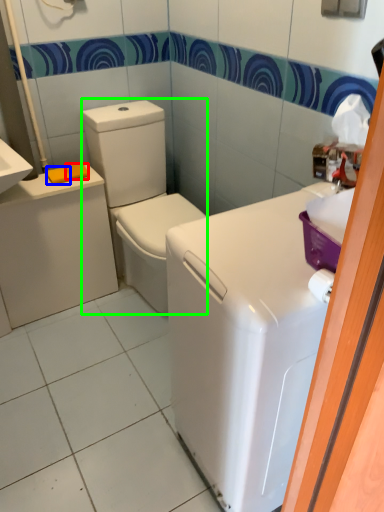
Question: Which object is positioned farthest from soap (highlighted by a red box)? Select from soap (highlighted by a blue box) and washer (highlighted by a green box).

Choices:
 (A) soap
 (B) washer

Answer: (B)